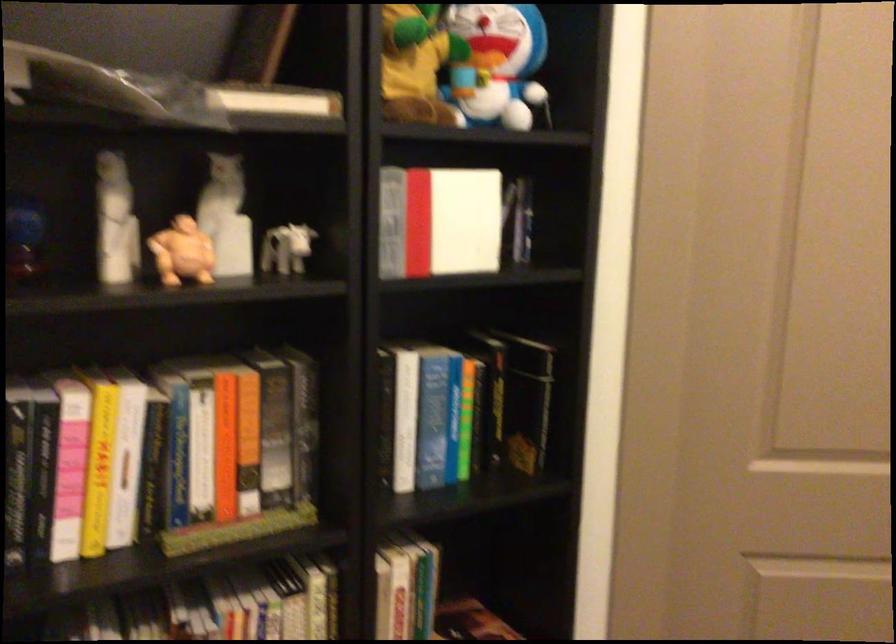
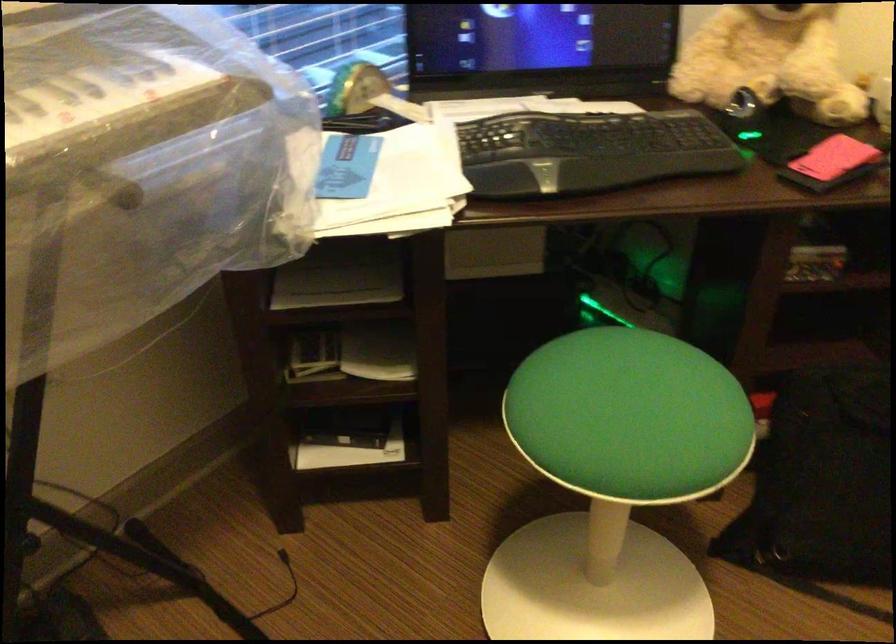
Based on the continuous images, in which direction is the camera rotating?

The camera's rotation is toward right-down.